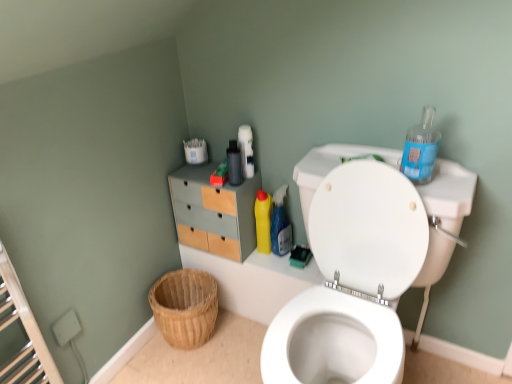
Measure the distance between matte black bottle at upper center and camera.

The distance of matte black bottle at upper center from camera is 1.49 meters.

Image resolution: width=512 pixels, height=384 pixels. What do you see at coordinates (185, 307) in the screenshot? I see `woven wood basket at lower left` at bounding box center [185, 307].

Measure the distance between blue plastic bottle at upper right, the first cleaning product from the front, and camera.

3.69 feet.

What do you see at coordinates (280, 225) in the screenshot? I see `yellow plastic bottle at upper right, arranged as the 2th cleaning product when viewed from the front` at bounding box center [280, 225].

The height and width of the screenshot is (384, 512). Describe the element at coordinates (352, 282) in the screenshot. I see `white glossy toilet at upper right` at that location.

This screenshot has width=512, height=384. What do you see at coordinates (214, 212) in the screenshot?
I see `matte wood/file cabinet at upper left` at bounding box center [214, 212].

Identify the location of matte black bottle at upper center. The height and width of the screenshot is (384, 512). (234, 164).

How different are the orientations of matte black bottle at upper center and blue plastic bottle at upper right, placed as the 3th cleaning product when sorted from left to right, in degrees?

The angle between the facing direction of matte black bottle at upper center and the facing direction of blue plastic bottle at upper right, placed as the 3th cleaning product when sorted from left to right, is 3.17 degrees.

Is matte black bottle at upper center to the right of blue plastic bottle at upper right, which appears as the 3th cleaning product when viewed from the back, from the viewer's perspective?

No.

Is point (239, 165) farther from camera compared to point (413, 165)?

Yes, point (239, 165) is behind point (413, 165).

Which of these two, matte black bottle at upper center or blue plastic bottle at upper right, placed as the 3th cleaning product when sorted from left to right, is wider?

Wider between the two is blue plastic bottle at upper right, placed as the 3th cleaning product when sorted from left to right.

Based on the photo, from a real-world perspective, which is physically below, matte wood/file cabinet at upper left or yellow plastic bottle at center, which is counted as the 3th cleaning product, starting from the right?

yellow plastic bottle at center, which is counted as the 3th cleaning product, starting from the right.

Measure the distance between matte wood/file cabinet at upper left and yellow plastic bottle at center, which is counted as the 3th cleaning product, starting from the right.

A distance of 16.22 centimeters exists between matte wood/file cabinet at upper left and yellow plastic bottle at center, which is counted as the 3th cleaning product, starting from the right.

Considering the points (183, 206) and (260, 189), which point is in front, point (183, 206) or point (260, 189)?

The point (260, 189) is more forward.

From the image's perspective, which one is positioned higher, yellow plastic bottle at center, which is the 3th cleaning product from front to back, or woven wood basket at lower left?

From the image's view, yellow plastic bottle at center, which is the 3th cleaning product from front to back, is above.

Which point is more distant from viewer, (263, 215) or (205, 332)?

The point (205, 332) is farther.

From the picture: From a real-world perspective, is yellow plastic bottle at center, which is counted as the 3th cleaning product, starting from the right, positioned over woven wood basket at lower left based on gravity?

Yes, from a real-world perspective, yellow plastic bottle at center, which is counted as the 3th cleaning product, starting from the right, is above woven wood basket at lower left.

Based on their positions, is yellow plastic bottle at center, which is counted as the first cleaning product, starting from the left, located to the left or right of woven wood basket at lower left?

yellow plastic bottle at center, which is counted as the first cleaning product, starting from the left, is to the right of woven wood basket at lower left.

Measure the distance from woven wood basket at lower left to matte black bottle at upper center.

woven wood basket at lower left and matte black bottle at upper center are 21.91 inches apart.

Which point is more distant from viewer, (188, 303) or (240, 180)?

Positioned behind is point (188, 303).

Which is more to the left, woven wood basket at lower left or matte black bottle at upper center?

woven wood basket at lower left is more to the left.

Locate an element on the screen. Image resolution: width=512 pixels, height=384 pixels. basket on the left of matte black bottle at upper center is located at coordinates (185, 307).

From a real-world perspective, which object stands above the other?

matte wood/file cabinet at upper left.

Does white glossy toilet at upper right appear on the right side of matte wood/file cabinet at upper left?

Indeed, white glossy toilet at upper right is positioned on the right side of matte wood/file cabinet at upper left.

Are white glossy toilet at upper right and matte wood/file cabinet at upper left far apart?

They are positioned close to each other.

Is white glossy toilet at upper right bigger or smaller than matte wood/file cabinet at upper left?

In the image, white glossy toilet at upper right appears to be larger than matte wood/file cabinet at upper left.

Which object is positioned more to the right, matte wood/file cabinet at upper left or matte black bottle at upper center?

From the viewer's perspective, matte black bottle at upper center appears more on the right side.

Between point (199, 247) and point (240, 171), which one is positioned in front?

The point (240, 171) is in front.

Looking at this image, is matte wood/file cabinet at upper left bigger than matte black bottle at upper center?

Yes, matte wood/file cabinet at upper left is bigger than matte black bottle at upper center.

Are white glossy toilet at upper right and woven wood basket at lower left far apart?

No, white glossy toilet at upper right is not far from woven wood basket at lower left.

From the image's perspective, is white glossy toilet at upper right located above or below woven wood basket at lower left?

Based on their image positions, white glossy toilet at upper right is located above woven wood basket at lower left.

Is white glossy toilet at upper right aimed at woven wood basket at lower left?

No.

The image size is (512, 384). Identify the location of cleaning product above the matte black bottle at upper center (from a real-world perspective). [x=421, y=149].

This screenshot has height=384, width=512. What are the coordinates of `file cabinet on the left of yellow plastic bottle at center, which is the 3th cleaning product from front to back` in the screenshot? It's located at (214, 212).

Considering their positions, is yellow plastic bottle at center, which is counted as the 3th cleaning product, starting from the right, positioned closer to matte wood/file cabinet at upper left than white glossy toilet at upper right?

yellow plastic bottle at center, which is counted as the 3th cleaning product, starting from the right.

Looking at this image, based on their spatial positions, is blue plastic bottle at upper right, the first cleaning product from the front, or yellow plastic bottle at upper right, which is counted as the 2th cleaning product, starting from the back, closer to matte black bottle at upper center?

yellow plastic bottle at upper right, which is counted as the 2th cleaning product, starting from the back, lies closer to matte black bottle at upper center than the other object.

From the image, which object appears to be farther from blue plastic bottle at upper right, placed as the 3th cleaning product when sorted from left to right, yellow plastic bottle at upper right, arranged as the second cleaning product when viewed from the left, or white glossy toilet at upper right?

yellow plastic bottle at upper right, arranged as the second cleaning product when viewed from the left.

From the image, which object appears to be farther from yellow plastic bottle at center, which is counted as the 3th cleaning product, starting from the right, matte wood/file cabinet at upper left or white glossy toilet at upper right?

Among the two, white glossy toilet at upper right is located further to yellow plastic bottle at center, which is counted as the 3th cleaning product, starting from the right.

When comparing their distances from woven wood basket at lower left, does matte black bottle at upper center or matte wood/file cabinet at upper left seem closer?

matte wood/file cabinet at upper left lies closer to woven wood basket at lower left than the other object.

Consider the image. From the image, which object appears to be nearer to matte wood/file cabinet at upper left, matte black bottle at upper center or blue plastic bottle at upper right, which appears as the 3th cleaning product when viewed from the back?

matte black bottle at upper center is positioned closer to the anchor matte wood/file cabinet at upper left.

From the image, which object appears to be farther from matte black bottle at upper center, matte wood/file cabinet at upper left or woven wood basket at lower left?

woven wood basket at lower left lies further to matte black bottle at upper center than the other object.

Looking at the image, which one is located further to matte black bottle at upper center, white glossy toilet at upper right or woven wood basket at lower left?

woven wood basket at lower left is further to matte black bottle at upper center.

Locate an element on the screen. file cabinet located between white glossy toilet at upper right and yellow plastic bottle at upper right, which is counted as the 2th cleaning product, starting from the back, in the depth direction is located at coordinates (214, 212).

This screenshot has height=384, width=512. What are the coordinates of `file cabinet between white glossy toilet at upper right and yellow plastic bottle at center, which is the first cleaning product in back-to-front order, along the z-axis` in the screenshot? It's located at (214, 212).

Where is `file cabinet between woven wood basket at lower left and blue plastic bottle at upper right, which appears as the 3th cleaning product when viewed from the back, from left to right`? The height and width of the screenshot is (384, 512). file cabinet between woven wood basket at lower left and blue plastic bottle at upper right, which appears as the 3th cleaning product when viewed from the back, from left to right is located at coordinates click(x=214, y=212).

Image resolution: width=512 pixels, height=384 pixels. Identify the location of bottle between woven wood basket at lower left and blue plastic bottle at upper right, placed as the 3th cleaning product when sorted from left to right. (234, 164).